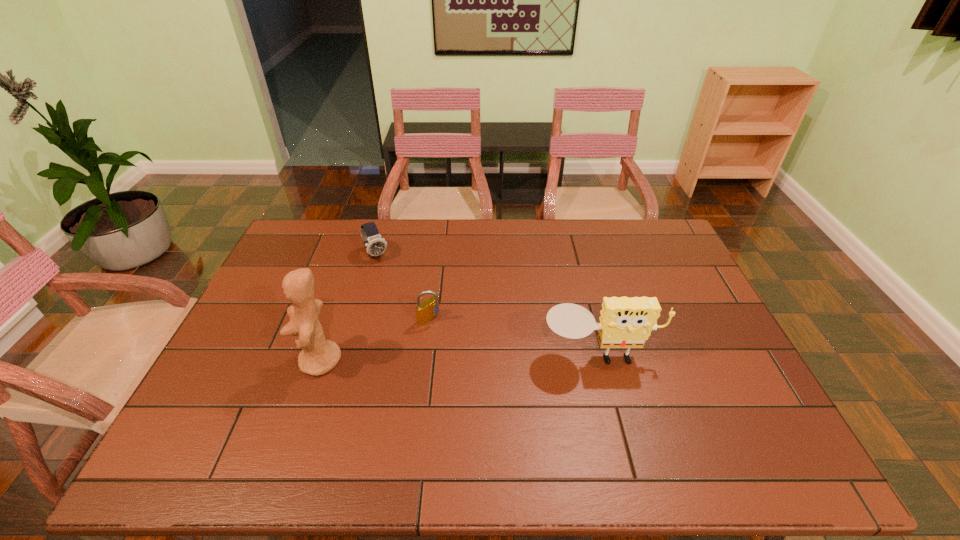
Locate an element on the screen. vacant region located on the face of the farthest object is located at coordinates (415, 319).

The image size is (960, 540). Find the location of `vacant space positioned on the face of the farthest object`. vacant space positioned on the face of the farthest object is located at coordinates (393, 283).

Image resolution: width=960 pixels, height=540 pixels. In order to click on vacant region located 0.250m on the face of the farthest object in this screenshot , I will do `click(410, 310)`.

Locate an element on the screen. vacant space located 0.200m on the side with the combination dials of the padlock is located at coordinates (486, 364).

I want to click on free space located 0.160m on the side with the combination dials of the padlock, so click(475, 355).

Locate an element on the screen. free space located 0.380m on the side with the combination dials of the padlock is located at coordinates (538, 407).

Where is `object positioned at the far edge`? object positioned at the far edge is located at coordinates click(375, 245).

Locate an element on the screen. The image size is (960, 540). vacant region at the far edge of the desktop is located at coordinates (335, 253).

This screenshot has width=960, height=540. I want to click on vacant point at the left edge, so click(276, 268).

The width and height of the screenshot is (960, 540). Identify the location of free space at the right edge. (681, 334).